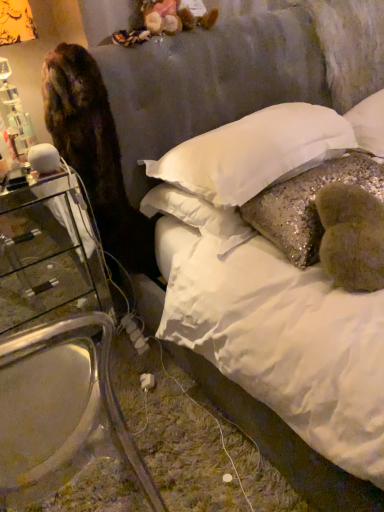
Question: Can white sequined pillow at center, which is counted as the 3th pillow, starting from the right, be found inside glittery sequined pillow at center, the 2th pillow positioned from the left?

Choices:
 (A) yes
 (B) no

Answer: (B)

Question: From a real-world perspective, is glittery sequined pillow at center, positioned as the second pillow in right-to-left order, under white sequined pillow at center, which is counted as the 3th pillow, starting from the right?

Choices:
 (A) yes
 (B) no

Answer: (A)

Question: Does glittery sequined pillow at center, positioned as the second pillow in right-to-left order, come in front of white sequined pillow at center, the 1th pillow in the left-to-right sequence?

Choices:
 (A) yes
 (B) no

Answer: (A)

Question: Does glittery sequined pillow at center, the 2th pillow positioned from the left, have a greater width compared to white sequined pillow at center, the 1th pillow in the left-to-right sequence?

Choices:
 (A) no
 (B) yes

Answer: (A)

Question: Considering the relative sizes of glittery sequined pillow at center, the 2th pillow positioned from the left, and white sequined pillow at center, which is counted as the 3th pillow, starting from the right, in the image provided, is glittery sequined pillow at center, the 2th pillow positioned from the left, bigger than white sequined pillow at center, which is counted as the 3th pillow, starting from the right,?

Choices:
 (A) no
 (B) yes

Answer: (A)

Question: Is white sequined pillow at center, which is counted as the 3th pillow, starting from the right, to the left or to the right of clear glass nightstand at left in the image?

Choices:
 (A) left
 (B) right

Answer: (B)

Question: Is point (296, 121) closer or farther from the camera than point (82, 247)?

Choices:
 (A) farther
 (B) closer

Answer: (B)

Question: Is white sequined pillow at center, which is counted as the 3th pillow, starting from the right, in front of or behind clear glass nightstand at left in the image?

Choices:
 (A) front
 (B) behind

Answer: (A)

Question: From a real-world perspective, relative to clear glass nightstand at left, is white sequined pillow at center, the 1th pillow in the left-to-right sequence, vertically above or below?

Choices:
 (A) above
 (B) below

Answer: (A)

Question: Choose the correct answer: Is clear glass nightstand at left inside white sequined pillow at center, the 1th pillow in the left-to-right sequence, or outside it?

Choices:
 (A) outside
 (B) inside

Answer: (A)

Question: From the image's perspective, is clear glass nightstand at left located above or below white sequined pillow at center, the 1th pillow in the left-to-right sequence?

Choices:
 (A) below
 (B) above

Answer: (A)

Question: Considering the positions of clear glass nightstand at left and white sequined pillow at center, the 1th pillow in the left-to-right sequence, in the image, is clear glass nightstand at left taller or shorter than white sequined pillow at center, the 1th pillow in the left-to-right sequence,?

Choices:
 (A) short
 (B) tall

Answer: (B)

Question: Based on their sizes in the image, would you say clear glass nightstand at left is bigger or smaller than white sequined pillow at center, which is counted as the 3th pillow, starting from the right?

Choices:
 (A) small
 (B) big

Answer: (B)

Question: In terms of height, does glittery sequined pillow at center, the 2th pillow positioned from the left, look taller or shorter compared to white soft pillow at upper center, which appears as the 1th pillow when viewed from the right?

Choices:
 (A) short
 (B) tall

Answer: (A)

Question: Is glittery sequined pillow at center, positioned as the second pillow in right-to-left order, situated inside white soft pillow at upper center, the 3th pillow viewed from the left, or outside?

Choices:
 (A) inside
 (B) outside

Answer: (B)